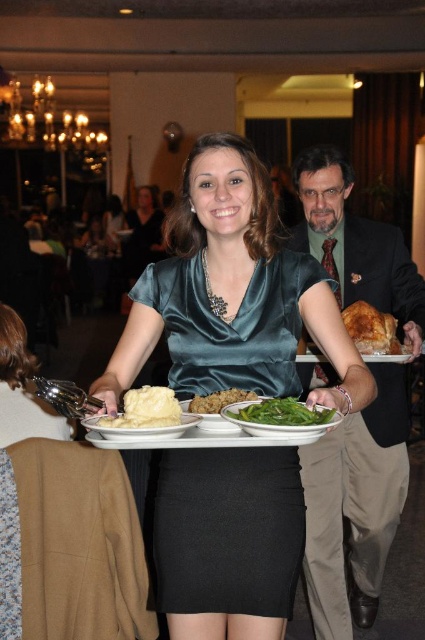
Question: Which object is the farthest from the matte black suit at center?

Choices:
 (A) green matte asparagus at center
 (B) white creamy mashed potatoes at center
 (C) white matte plate at center
 (D) golden crispy turkey at right

Answer: (C)

Question: Estimate the real-world distances between objects in this image. Which object is closer to the white matte plate at center?

Choices:
 (A) white creamy mashed potatoes at center
 (B) matte black suit at center
 (C) green matte asparagus at center

Answer: (A)

Question: Can you confirm if satin dress at center is bigger than green matte asparagus at center?

Choices:
 (A) no
 (B) yes

Answer: (B)

Question: Can you confirm if white matte plate at center is smaller than brown crumbly bread at center?

Choices:
 (A) yes
 (B) no

Answer: (B)

Question: In this image, where is matte black suit at center located relative to golden crispy turkey at right?

Choices:
 (A) left
 (B) right

Answer: (B)

Question: Which point appears closest to the camera in this image?

Choices:
 (A) (146, 428)
 (B) (384, 531)
 (C) (223, 388)

Answer: (A)